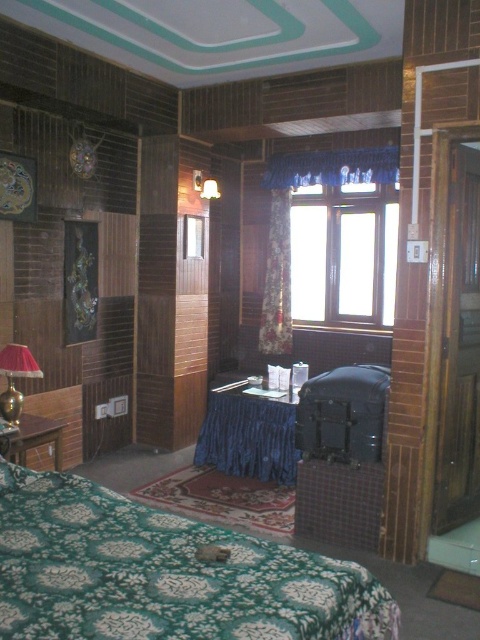
Question: Which point appears farthest from the camera in this image?

Choices:
 (A) (280, 413)
 (B) (51, 442)
 (C) (268, 337)
 (D) (308, 189)

Answer: (C)

Question: Which point is farther to the camera?

Choices:
 (A) clear glass window at center
 (B) brass/metallic table lamp at left

Answer: (A)

Question: Does clear glass window at center appear under brass/metallic table lamp at left?

Choices:
 (A) no
 (B) yes

Answer: (A)

Question: Does green floral fabric bed at lower left have a greater width compared to floral fabric curtain at center?

Choices:
 (A) no
 (B) yes

Answer: (B)

Question: Does green floral fabric bed at lower left appear on the left side of wooden table at left?

Choices:
 (A) no
 (B) yes

Answer: (A)

Question: Which object is the closest to the floral fabric curtain at center?

Choices:
 (A) green floral fabric bed at lower left
 (B) wooden table at left
 (C) blue satin table at center

Answer: (C)